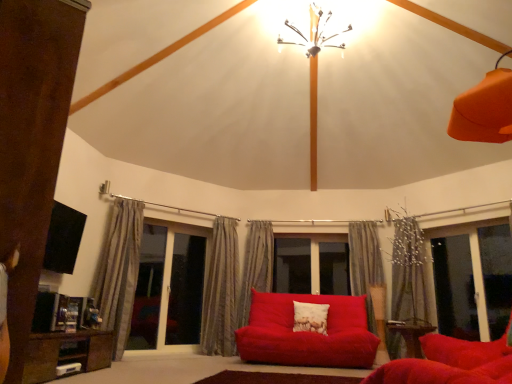
Question: Should I look upward or downward to see transparent glass screen door at left, the first screen door viewed from the left?

Choices:
 (A) down
 (B) up

Answer: (A)

Question: From the image's perspective, would you say brown wood entertainment unit at left is shown under metallic chandelier at upper center?

Choices:
 (A) no
 (B) yes

Answer: (B)

Question: Could you tell me if brown wood entertainment unit at left is facing metallic chandelier at upper center?

Choices:
 (A) yes
 (B) no

Answer: (B)

Question: Is metallic chandelier at upper center at the back of brown wood entertainment unit at left?

Choices:
 (A) yes
 (B) no

Answer: (B)

Question: Is the surface of brown wood entertainment unit at left in direct contact with metallic chandelier at upper center?

Choices:
 (A) no
 (B) yes

Answer: (A)

Question: Does brown wood entertainment unit at left have a lesser height compared to metallic chandelier at upper center?

Choices:
 (A) no
 (B) yes

Answer: (A)

Question: Can you confirm if brown wood entertainment unit at left is smaller than metallic chandelier at upper center?

Choices:
 (A) yes
 (B) no

Answer: (B)

Question: Is silky beige curtain at center, which appears as the 4th curtain when viewed from the right, positioned with its back to white textured pillow at center?

Choices:
 (A) yes
 (B) no

Answer: (B)

Question: From the image's perspective, is silky beige curtain at center, which appears as the 4th curtain when viewed from the right, located beneath white textured pillow at center?

Choices:
 (A) no
 (B) yes

Answer: (A)

Question: Is silky beige curtain at center, which is the 2th curtain in left-to-right order, not inside white textured pillow at center?

Choices:
 (A) no
 (B) yes

Answer: (B)

Question: Is silky beige curtain at center, which appears as the 4th curtain when viewed from the right, bigger than white textured pillow at center?

Choices:
 (A) no
 (B) yes

Answer: (B)

Question: Does silky beige curtain at center, which is the 2th curtain in left-to-right order, lie behind white textured pillow at center?

Choices:
 (A) no
 (B) yes

Answer: (B)

Question: From the image's perspective, is silky beige curtain at center, which is the 2th curtain in left-to-right order, above white textured pillow at center?

Choices:
 (A) yes
 (B) no

Answer: (A)

Question: Does metallic chandelier at upper center appear on the right side of silky gray curtain at center, placed as the 3th curtain when sorted from right to left?

Choices:
 (A) yes
 (B) no

Answer: (A)